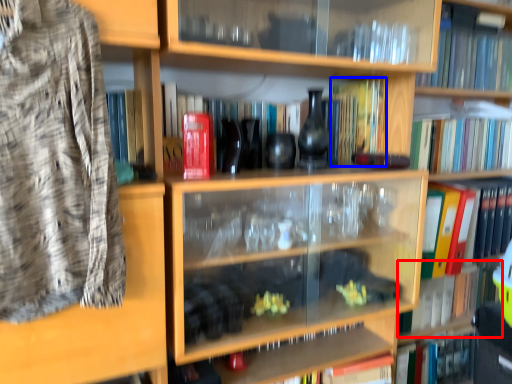
Question: Which object appears farthest to the camera in this image, book (highlighted by a red box) or book (highlighted by a blue box)?

Choices:
 (A) book
 (B) book

Answer: (A)